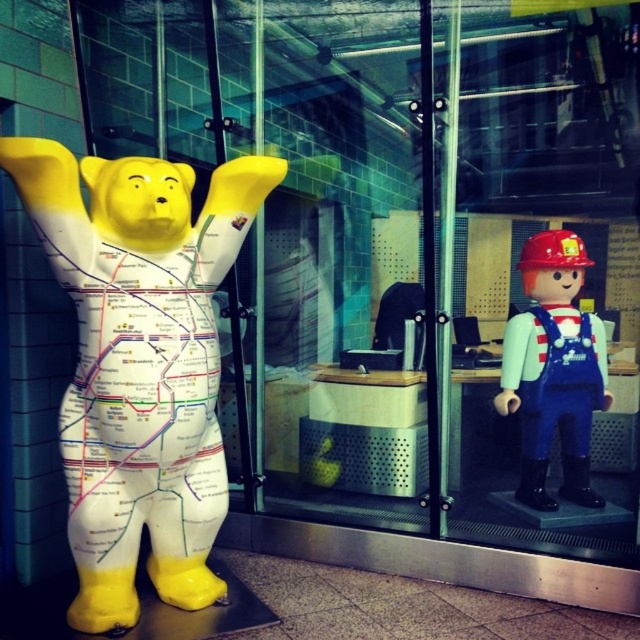
Between yellow matte bear at left and matte blue overalls at right, which one is positioned higher?

matte blue overalls at right is above.

Is yellow matte bear at left shorter than matte blue overalls at right?

Incorrect, yellow matte bear at left's height does not fall short of matte blue overalls at right's.

Is point (106, 429) in front of point (586, 472)?

Yes, point (106, 429) is in front of point (586, 472).

At what (x,y) coordinates should I click in order to perform the action: click on yellow matte bear at left. Please return your answer as a coordinate pair (x, y). Looking at the image, I should click on (140, 362).